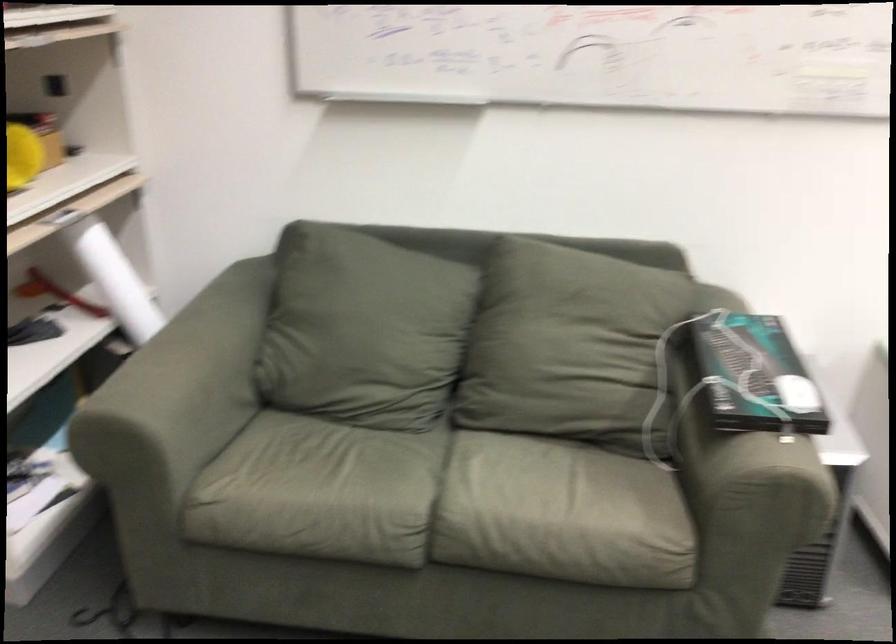
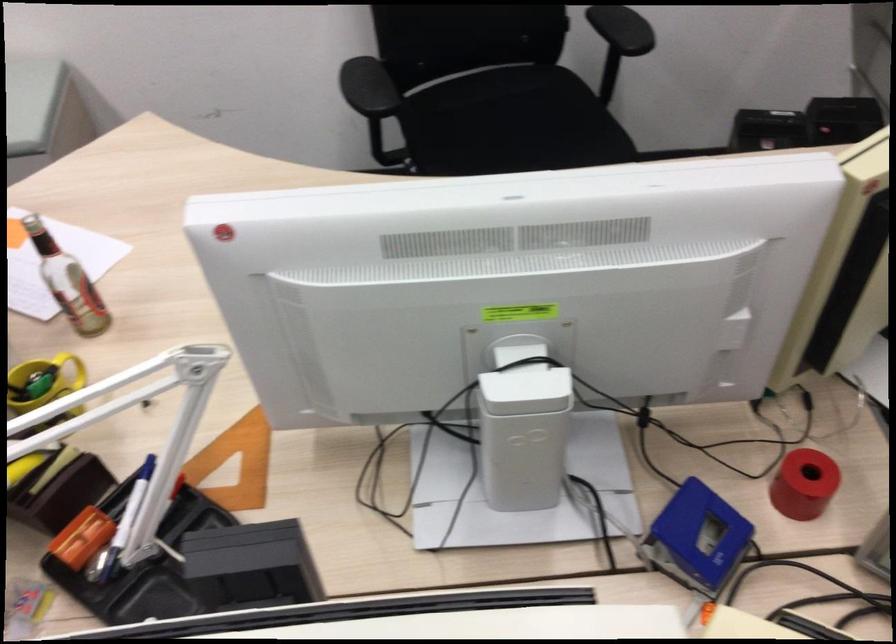
Question: What movement of the cameraman would produce the second image?

Choices:
 (A) Left
 (B) Right
 (C) Forward
 (D) Backward

Answer: (B)